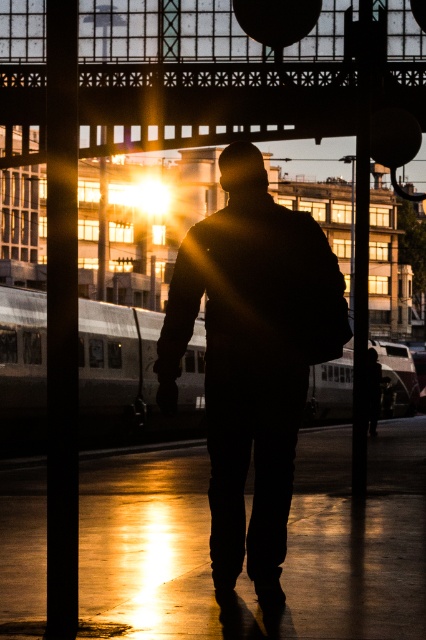
Question: Considering the relative positions of black matte jacket at center and silver metallic train at center in the image provided, where is black matte jacket at center located with respect to silver metallic train at center?

Choices:
 (A) below
 (B) above

Answer: (B)

Question: Which point is farther to the camera?

Choices:
 (A) silver metallic train at center
 (B) black matte jacket at center

Answer: (A)

Question: Observing the image, what is the correct spatial positioning of black matte jacket at center in reference to silver metallic train at center?

Choices:
 (A) below
 (B) above

Answer: (B)

Question: Is black matte jacket at center closer to the viewer compared to silver metallic train at center?

Choices:
 (A) yes
 (B) no

Answer: (A)